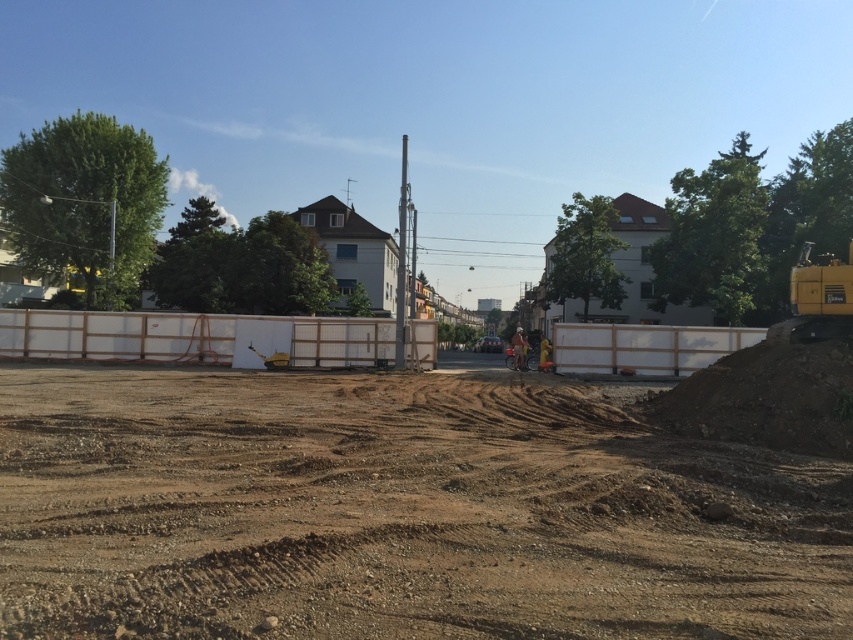
Can you confirm if brown sandy dirt at center is taller than white plastic barrier at center?

No, brown sandy dirt at center is not taller than white plastic barrier at center.

Between brown sandy dirt at center and white plastic barrier at center, which one is positioned lower?

brown sandy dirt at center is lower down.

This screenshot has width=853, height=640. Identify the location of brown sandy dirt at center. (398, 512).

Does white wooden fence at center have a smaller size compared to yellow metallic excavator at right?

Yes, white wooden fence at center is smaller than yellow metallic excavator at right.

Is point (334, 355) less distant than point (804, 278)?

That is False.

The width and height of the screenshot is (853, 640). Identify the location of white wooden fence at center. [195, 337].

Which is more to the left, brown sandy dirt at center or yellow metallic excavator at right?

brown sandy dirt at center

Where is `brown sandy dirt at center`? The width and height of the screenshot is (853, 640). brown sandy dirt at center is located at coordinates (398, 512).